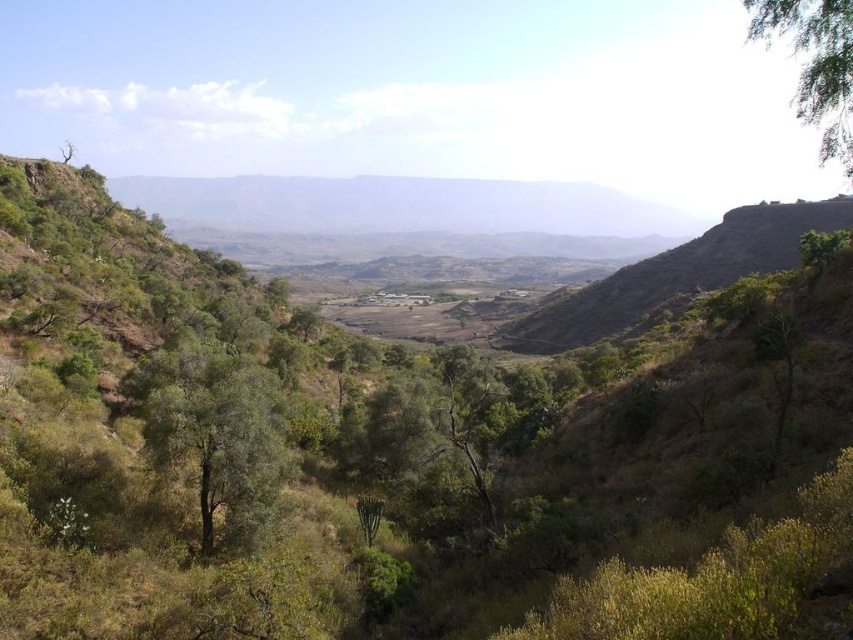
You are a farmer planning to plant a new row of crops between the green leafy tree at center and the green leafy tree at upper right. If your tractor can only cover a maximum distance of 25 meters in one pass, will you be able to plant the entire row without stopping?

The distance between the green leafy tree at center and the green leafy tree at upper right is 25.28 meters. Since the tractor can only cover 25 meters in one pass, you will need to stop and adjust before completing the entire row.

You are standing at the origin point of the landscape. Based on the coordinates provided, in which direction should you walk to reach the green leafy tree at center?

The green leafy tree at center is located at coordinates point (216, 435). Since the x coordinate is 0.681 which is greater than 0.5, you should walk to the right. The y coordinate is 0.254 which is less than 0.5, so you should walk downward. Therefore, you should walk towards the right and downward direction to reach the green leafy tree at center.